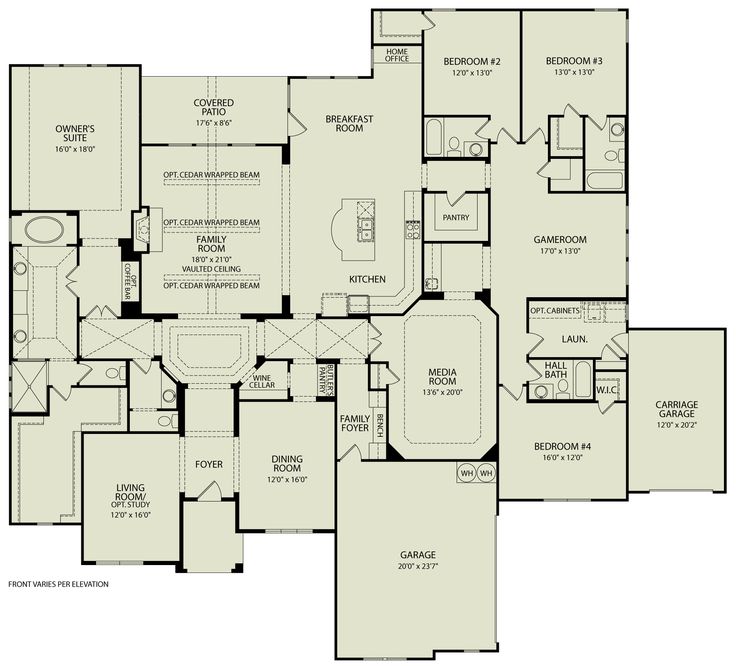
At what (x,y) coordinates should I click in order to perform the action: click on rooms. Please return your answer as a coordinate pair (x, y). Image resolution: width=736 pixels, height=666 pixels. Looking at the image, I should click on (107, 525), (297, 474), (472, 382), (567, 460), (570, 244), (580, 47), (473, 60), (344, 119), (213, 256), (87, 130).